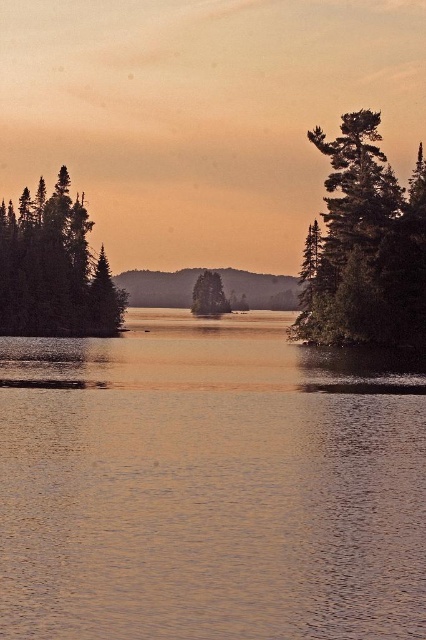
You are a photographer planning to capture the golden reflective water at center and the green matte tree at left in a single shot. Based on their positions, which object will appear closer to the camera in the photo?

The golden reflective water at center will appear closer to the camera because it is positioned in front of the green matte tree at left.

You are an observer standing at the lakeside. You notice the golden reflective water at center and the green matte tree at left. Which object is positioned lower in the scene?

The golden reflective water at center is positioned lower than the green matte tree at left in the scene.

You are an observer standing in the middle of the lakeside scene. You see the green matte tree at left and the green matte tree at center. Which tree is closer to your left side?

The green matte tree at left is positioned on the left side of green matte tree at center, so it is closer to your left side.